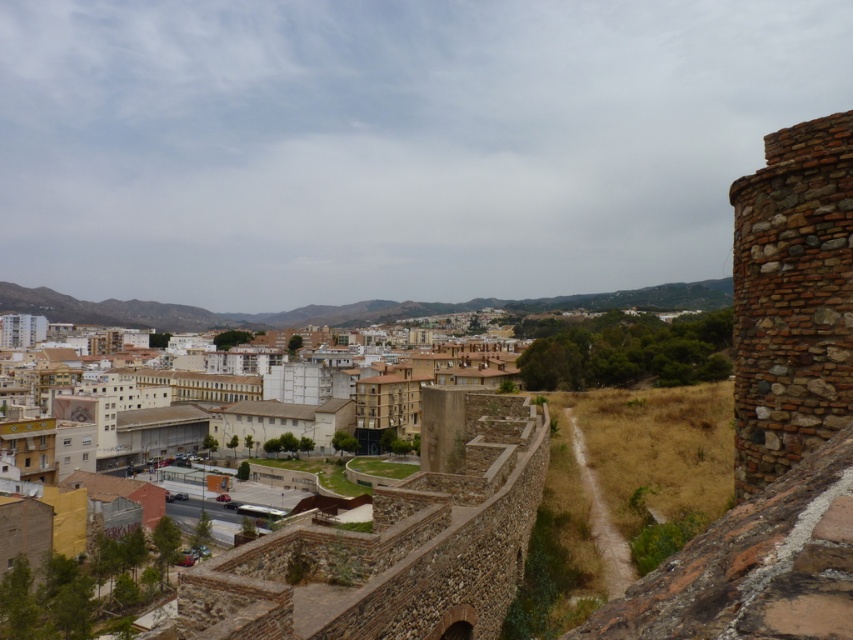
Question: Does white concrete buildings at center appear over brown stone tower at right?

Choices:
 (A) no
 (B) yes

Answer: (A)

Question: Does white concrete buildings at center appear over brown stone tower at right?

Choices:
 (A) yes
 (B) no

Answer: (B)

Question: Among these points, which one is farthest from the camera?

Choices:
 (A) (833, 340)
 (B) (187, 630)

Answer: (B)

Question: Does white concrete buildings at center have a lesser width compared to brown stone tower at right?

Choices:
 (A) yes
 (B) no

Answer: (B)

Question: Which object appears closest to the camera in this image?

Choices:
 (A) brown stone tower at right
 (B) white concrete buildings at center

Answer: (A)